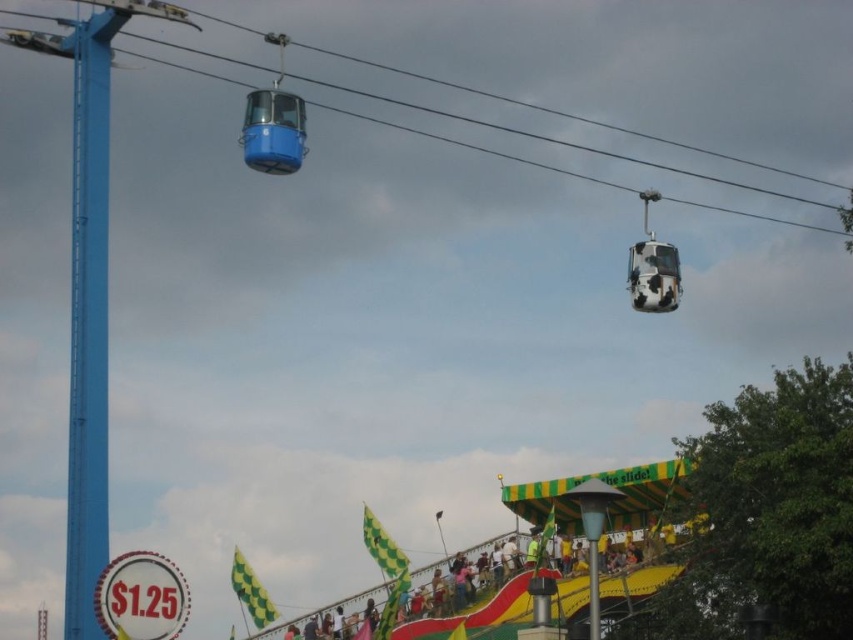
From the picture: Does yellow-green checkered flag at center have a greater width compared to blue glossy cable car at upper center?

Yes, yellow-green checkered flag at center is wider than blue glossy cable car at upper center.

Can you confirm if yellow-green checkered flag at center is smaller than blue glossy cable car at upper center?

No, yellow-green checkered flag at center is not smaller than blue glossy cable car at upper center.

Does point (560, 592) come behind point (258, 170)?

Yes, point (560, 592) is farther from viewer.

Find the location of a particular element. The width and height of the screenshot is (853, 640). yellow-green checkered flag at center is located at coordinates (477, 612).

Looking at this image, does blue glossy cable car at upper center have a lesser width compared to cow print fabric at upper center?

In fact, blue glossy cable car at upper center might be wider than cow print fabric at upper center.

Who is more distant from viewer, (250, 145) or (650, 252)?

The point (650, 252) is more distant.

The width and height of the screenshot is (853, 640). Find the location of `blue glossy cable car at upper center`. blue glossy cable car at upper center is located at coordinates (273, 131).

Which is in front, point (508, 614) or point (656, 304)?

Point (508, 614) is in front.

Is yellow-green checkered flag at center to the right of cow print fabric at upper center from the viewer's perspective?

Incorrect, yellow-green checkered flag at center is not on the right side of cow print fabric at upper center.

At what (x,y) coordinates should I click in order to perform the action: click on yellow-green checkered flag at center. Please return your answer as a coordinate pair (x, y). Looking at the image, I should click on (477, 612).

Where is `yellow-green checkered flag at center`? yellow-green checkered flag at center is located at coordinates (477, 612).